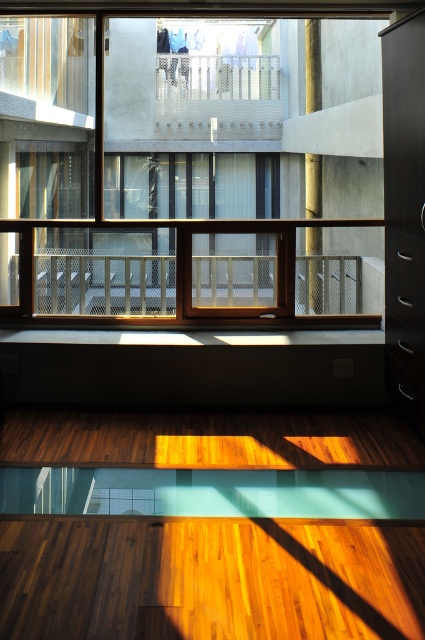
Question: Which point is farther from the camera taking this photo?

Choices:
 (A) (214, 180)
 (B) (376, 246)
 (C) (306, 244)

Answer: (A)

Question: Which point is closer to the camera?

Choices:
 (A) (255, 227)
 (B) (107, 106)

Answer: (A)

Question: Where is metallic mesh balcony at center located in relation to gold textured pillar at center in the image?

Choices:
 (A) left
 (B) right

Answer: (A)

Question: Does clear glass window at center appear under metallic mesh balcony at center?

Choices:
 (A) yes
 (B) no

Answer: (B)

Question: Does clear glass window at center appear under metallic mesh balcony at center?

Choices:
 (A) no
 (B) yes

Answer: (A)

Question: Which point appears closest to the camera in this image?

Choices:
 (A) (316, 193)
 (B) (141, 240)

Answer: (B)